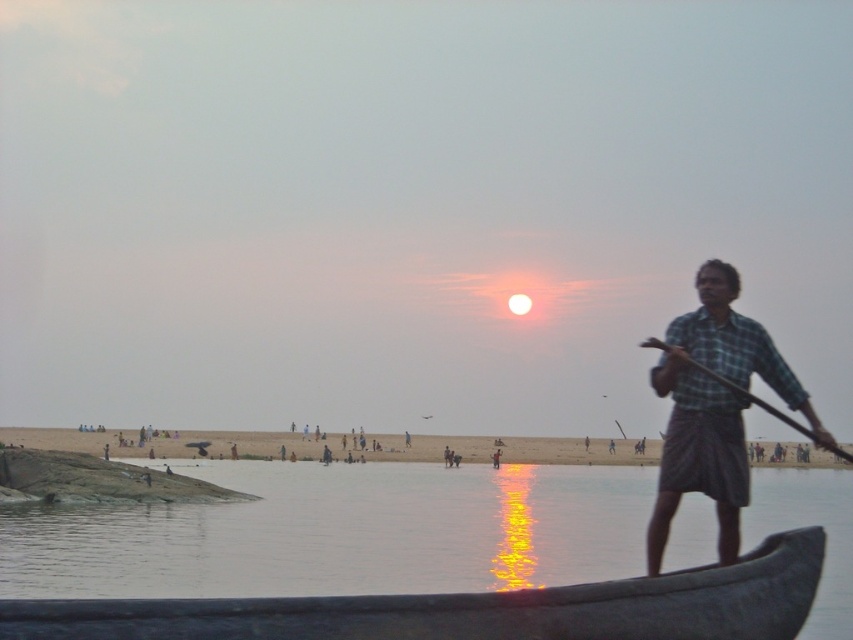
Image resolution: width=853 pixels, height=640 pixels. I want to click on checkered fabric shirt at right, so click(x=714, y=408).

Looking at this image, can you confirm if checkered fabric shirt at right is positioned to the left of wooden at right?

In fact, checkered fabric shirt at right is to the right of wooden at right.

Which is in front, point (712, 317) or point (753, 401)?

Point (753, 401)

Locate an element on the screen. This screenshot has width=853, height=640. checkered fabric shirt at right is located at coordinates (714, 408).

Can you confirm if smooth water at boat front is bigger than checkered fabric shirt at right?

Yes.

Between smooth water at boat front and checkered fabric shirt at right, which one has less height?

With less height is checkered fabric shirt at right.

Find the location of a particular element. Image resolution: width=853 pixels, height=640 pixels. smooth water at boat front is located at coordinates (341, 532).

Is smooth water at boat front shorter than wooden at right?

In fact, smooth water at boat front may be taller than wooden at right.

Does smooth water at boat front appear over wooden at right?

No, smooth water at boat front is not above wooden at right.

Is point (225, 544) positioned before point (645, 339)?

No, it is behind (645, 339).

The height and width of the screenshot is (640, 853). I want to click on smooth water at boat front, so click(341, 532).